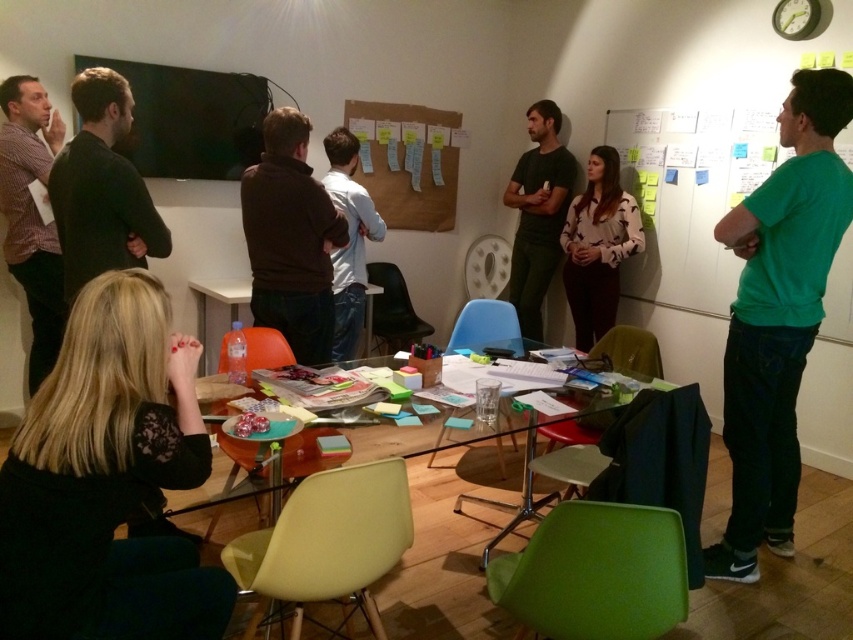
Question: Estimate the real-world distances between objects in this image. Which object is farther from the green matte shirt at center?

Choices:
 (A) cardboard bulletin board at upper center
 (B) white plastic table at center

Answer: (A)

Question: Is the position of black sweater at left less distant than that of white plastic table at center?

Choices:
 (A) yes
 (B) no

Answer: (A)

Question: Does black sweater at left have a smaller size compared to dark green shirt at center?

Choices:
 (A) yes
 (B) no

Answer: (A)

Question: Which point is closer to the camera?

Choices:
 (A) (331, 160)
 (B) (553, 208)
 (C) (32, 154)
 (D) (523, 481)

Answer: (D)

Question: Does black lace shirt at lower left come behind dark green shirt at center?

Choices:
 (A) no
 (B) yes

Answer: (A)

Question: Which point appears closest to the camera in this image?

Choices:
 (A) (230, 305)
 (B) (363, 257)
 (C) (264, 90)

Answer: (B)